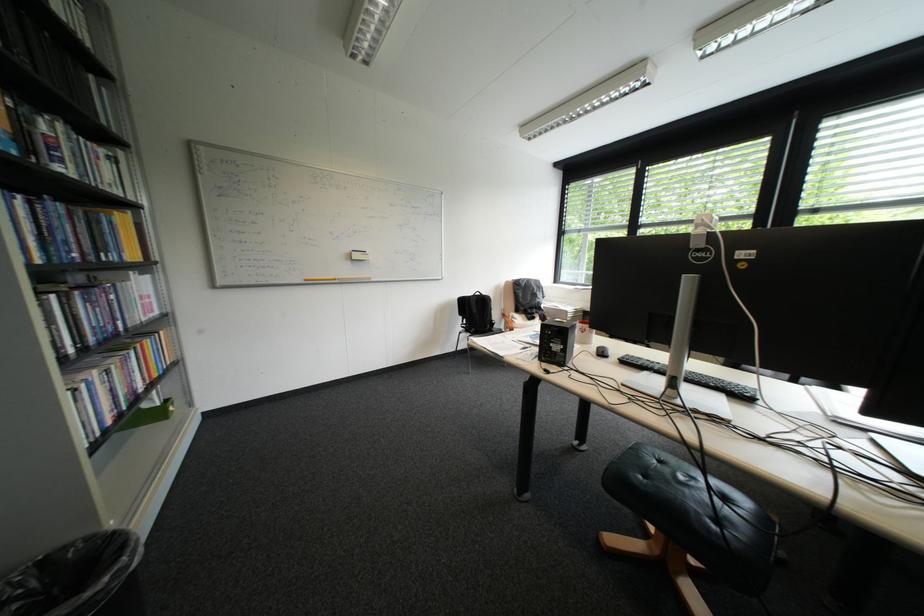
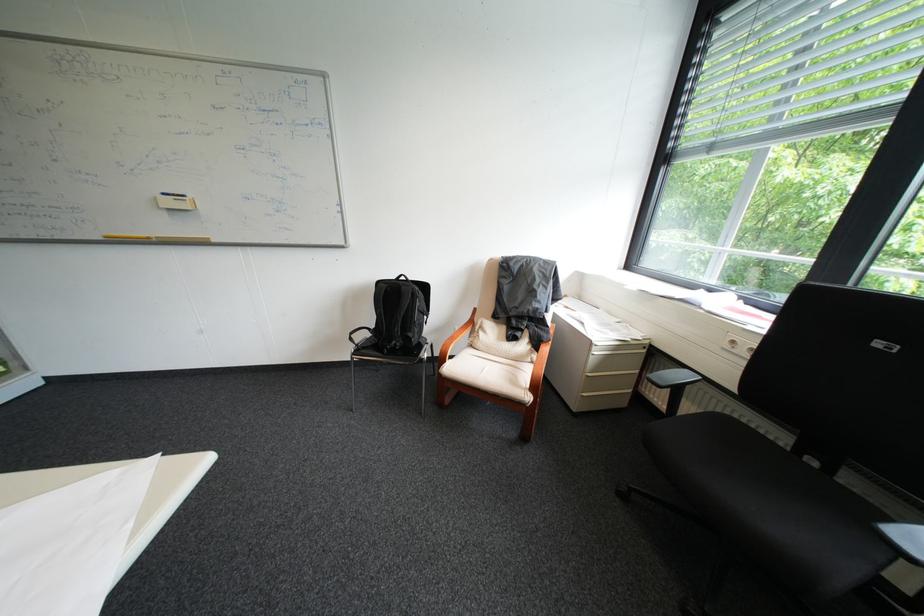
Find the pixel in the second image that matches pixel 366 252 in the first image.

(176, 195)